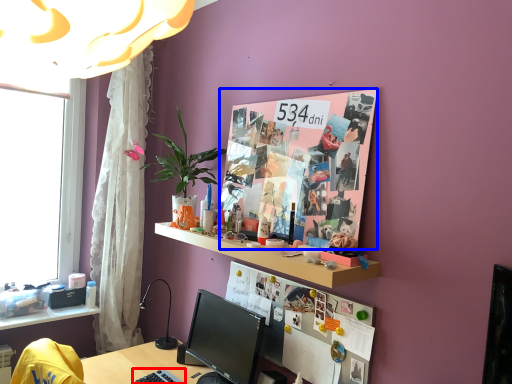
Question: Which object is further to the camera taking this photo, keyboard (highlighted by a red box) or poster page (highlighted by a blue box)?

Choices:
 (A) keyboard
 (B) poster page

Answer: (A)